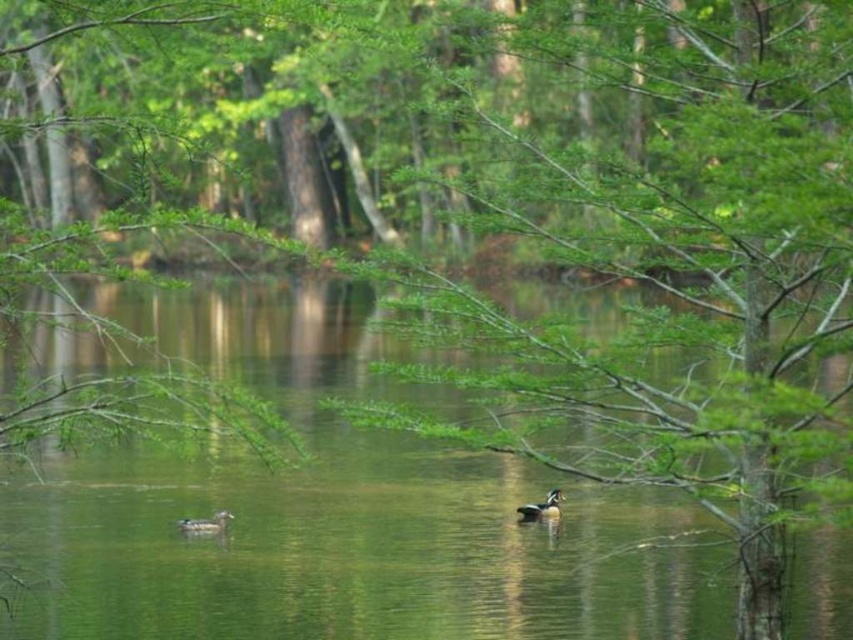
Question: Is green water at center in front of shiny brown duck at center?

Choices:
 (A) yes
 (B) no

Answer: (A)

Question: Does green water at center appear over shiny brown duck at lower left?

Choices:
 (A) yes
 (B) no

Answer: (A)

Question: Which point is closer to the camera taking this photo?

Choices:
 (A) (213, 516)
 (B) (558, 508)
 (C) (4, 484)

Answer: (A)

Question: Is shiny brown duck at center to the left of shiny brown duck at lower left from the viewer's perspective?

Choices:
 (A) no
 (B) yes

Answer: (A)

Question: Which of the following is the farthest from the observer?

Choices:
 (A) (572, 545)
 (B) (183, 528)
 (C) (556, 509)

Answer: (C)

Question: Which point appears closest to the camera in this image?

Choices:
 (A) (183, 520)
 (B) (548, 508)
 (C) (445, 602)

Answer: (C)